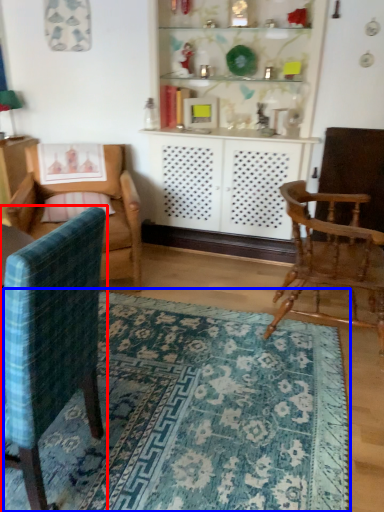
Question: Which point is closer to the camera, chair (highlighted by a red box) or mat (highlighted by a blue box)?

Choices:
 (A) chair
 (B) mat

Answer: (A)